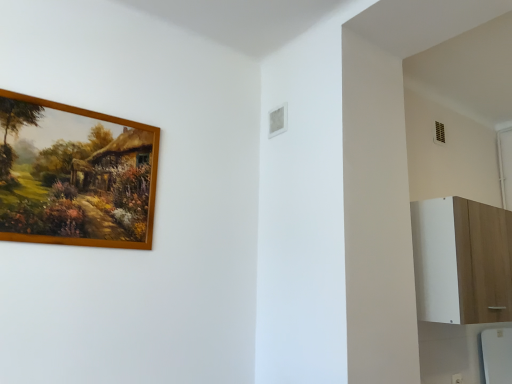
Question: From a real-world perspective, is white wood cabinet at right above or below wooden picture frame at upper left?

Choices:
 (A) below
 (B) above

Answer: (A)

Question: Based on their positions, is white wood cabinet at right located to the left or right of wooden picture frame at upper left?

Choices:
 (A) right
 (B) left

Answer: (A)

Question: From the image's perspective, is white wood cabinet at right above or below wooden picture frame at upper left?

Choices:
 (A) above
 (B) below

Answer: (B)

Question: Is wooden picture frame at upper left inside or outside of white wood cabinet at right?

Choices:
 (A) inside
 (B) outside

Answer: (B)

Question: From the image's perspective, is wooden picture frame at upper left positioned above or below white wood cabinet at right?

Choices:
 (A) above
 (B) below

Answer: (A)

Question: From a real-world perspective, is wooden picture frame at upper left positioned above or below white wood cabinet at right?

Choices:
 (A) above
 (B) below

Answer: (A)

Question: Is wooden picture frame at upper left taller or shorter than white wood cabinet at right?

Choices:
 (A) tall
 (B) short

Answer: (B)